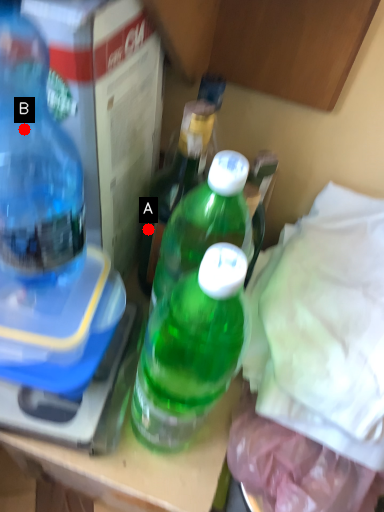
Question: Two points are circled on the image, labeled by A and B beside each circle. Among these points, which one is farthest from the camera?

Choices:
 (A) A is further
 (B) B is further

Answer: (A)